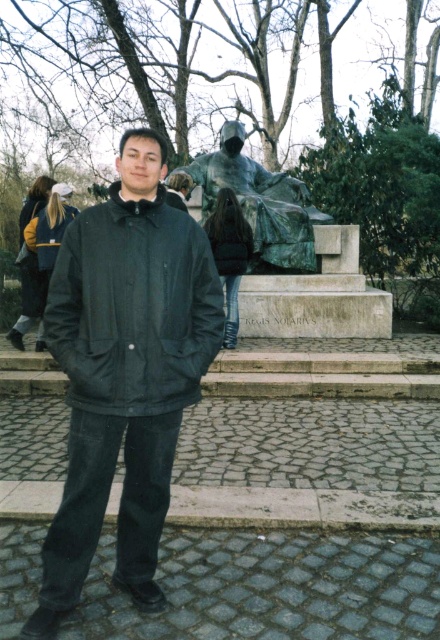
Question: Which object appears farthest from the camera in this image?

Choices:
 (A) matte black jacket at center
 (B) bronze statue at center

Answer: (B)

Question: Based on their relative distances, which object is nearer to the black matte jacket at center?

Choices:
 (A) matte black jacket at center
 (B) bronze statue at center

Answer: (A)

Question: Does matte black jacket at center have a lesser width compared to bronze statue at center?

Choices:
 (A) yes
 (B) no

Answer: (A)

Question: Which is farther from the black matte jacket at center?

Choices:
 (A) matte black jacket at center
 (B) bronze statue at center

Answer: (B)

Question: Is matte black jacket at center above bronze statue at center?

Choices:
 (A) yes
 (B) no

Answer: (B)

Question: Is black matte jacket at center above bronze statue at center?

Choices:
 (A) yes
 (B) no

Answer: (B)